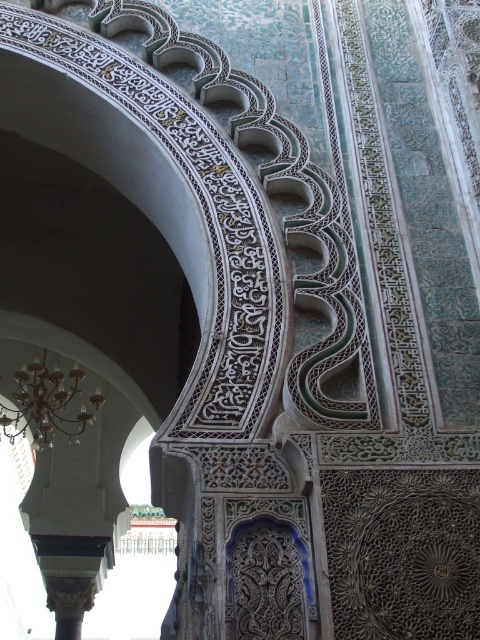
Question: Which point appears closest to the camera in this image?

Choices:
 (A) (84, 586)
 (B) (76, 422)

Answer: (A)

Question: Which object appears farthest from the camera in this image?

Choices:
 (A) gold metallic chandelier at upper center
 (B) carved stone column at lower left

Answer: (B)

Question: In this image, where is gold metallic chandelier at upper center located relative to carved stone column at lower left?

Choices:
 (A) below
 (B) above

Answer: (B)

Question: Does gold metallic chandelier at upper center have a larger size compared to carved stone column at lower left?

Choices:
 (A) yes
 (B) no

Answer: (A)

Question: Does gold metallic chandelier at upper center appear on the left side of carved stone column at lower left?

Choices:
 (A) yes
 (B) no

Answer: (A)